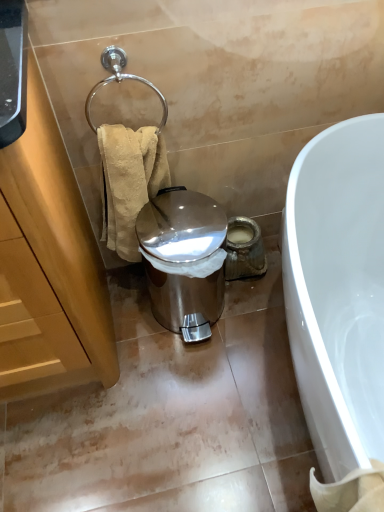
Question: Based on their sizes in the image, would you say white glossy bathtub at lower right is bigger or smaller than wooden cabinet at left?

Choices:
 (A) big
 (B) small

Answer: (A)

Question: Is point (360, 323) closer or farther from the camera than point (66, 335)?

Choices:
 (A) farther
 (B) closer

Answer: (A)

Question: Which object is the farthest from the polished chrome towel ring at upper left?

Choices:
 (A) white glossy bathtub at lower right
 (B) wooden cabinet at left
 (C) beige textured towel at left
 (D) shiny metallic trash can at center

Answer: (A)

Question: Estimate the real-world distances between objects in this image. Which object is farther from the white glossy bathtub at lower right?

Choices:
 (A) shiny metallic trash can at center
 (B) wooden cabinet at left
 (C) beige textured towel at left
 (D) polished chrome towel ring at upper left

Answer: (D)